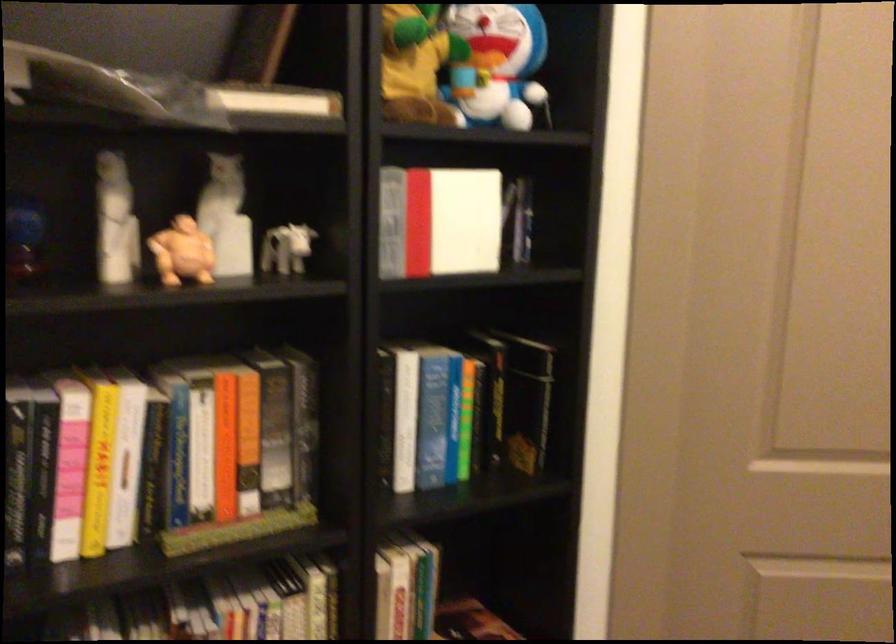
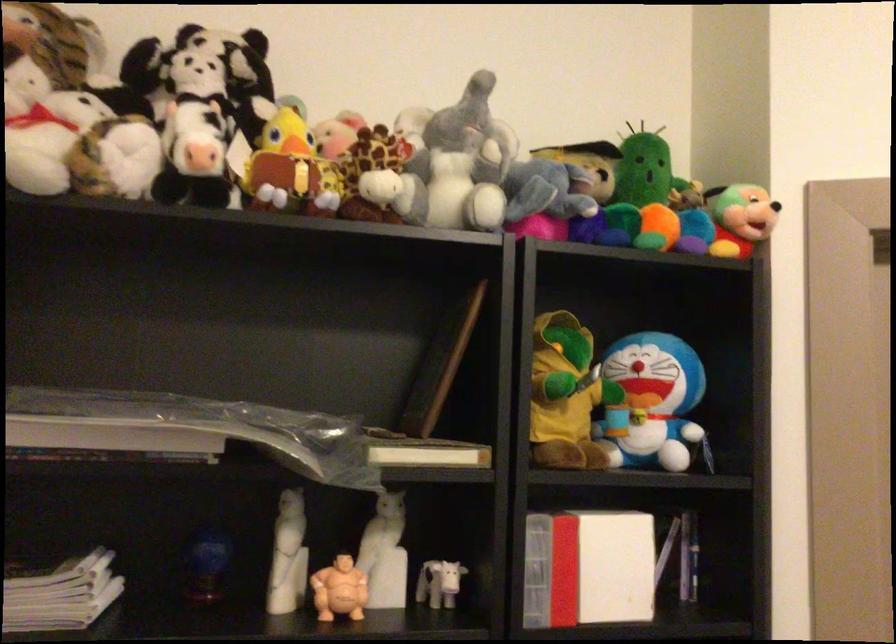
In the second image, find the point that corresponds to point 457,221 in the first image.

(609, 565)